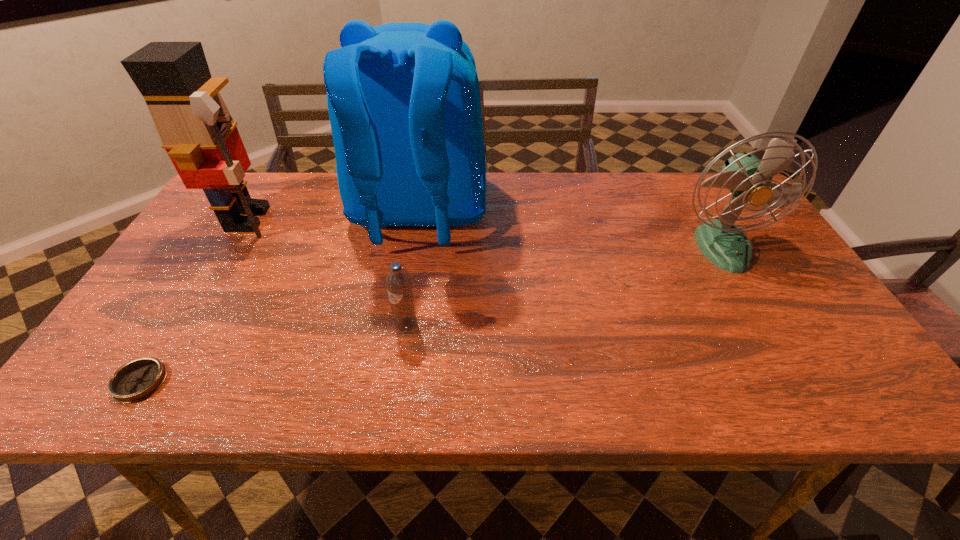
Locate an element on the screen. The height and width of the screenshot is (540, 960). backpack is located at coordinates (404, 104).

You are a GUI agent. You are given a task and a screenshot of the screen. Output one action in this format:
    pyautogui.click(x=<x>, y=<y>)
    Task: Click on the nutcracker
    
    Given the screenshot: What is the action you would take?
    pyautogui.click(x=197, y=131)

Identify the location of the third shortest object. (748, 179).

Locate an element on the screen. the rightmost object is located at coordinates (748, 179).

This screenshot has height=540, width=960. Identify the location of the fourth tallest object. (399, 287).

In order to click on water bottle in this screenshot , I will do `click(399, 287)`.

Where is `compass`? The height and width of the screenshot is (540, 960). compass is located at coordinates (138, 379).

Where is `the nearest object`? the nearest object is located at coordinates (138, 379).

This screenshot has width=960, height=540. Find the location of `blank space located on the back of the backpack`. blank space located on the back of the backpack is located at coordinates (403, 309).

Where is `vacant space located 0.260m in front of the nutcracker holding the staff`? This screenshot has height=540, width=960. vacant space located 0.260m in front of the nutcracker holding the staff is located at coordinates (371, 219).